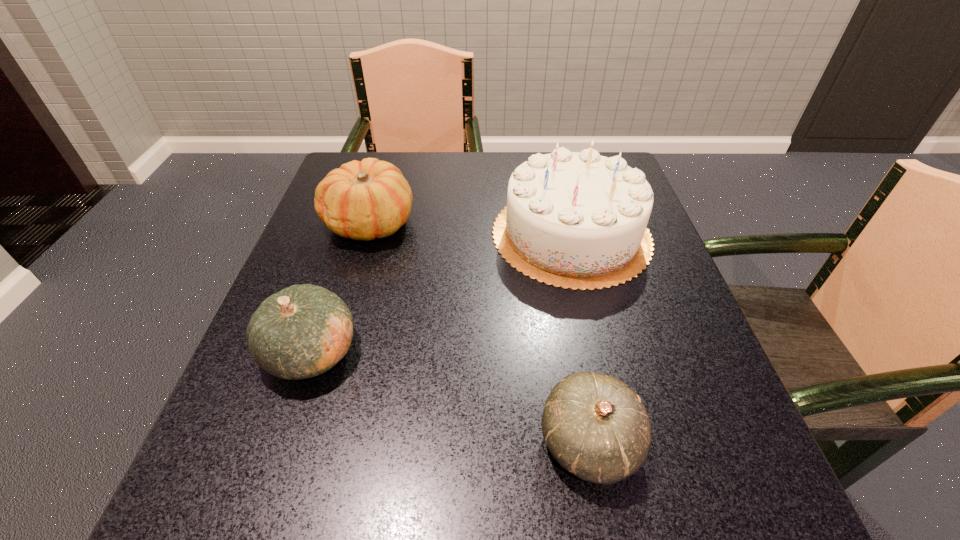
Find the location of a particular element. gourd at the far edge is located at coordinates (370, 199).

Identify the location of object that is at the near edge. (597, 428).

The width and height of the screenshot is (960, 540). What are the coordinates of `birthday cake that is at the right edge` in the screenshot? It's located at (577, 220).

Where is `gourd positioned at the right edge`? gourd positioned at the right edge is located at coordinates (597, 428).

At what (x,y) coordinates should I click in order to perform the action: click on object positioned at the far left corner. Please return your answer as a coordinate pair (x, y). This screenshot has height=540, width=960. Looking at the image, I should click on (370, 199).

Locate an element on the screen. object located at the far right corner is located at coordinates 577,220.

In order to click on object that is at the near right corner in this screenshot , I will do [597, 428].

At what (x,y) coordinates should I click in order to perform the action: click on free location at the far edge of the desktop. Please return your answer as a coordinate pair (x, y). The width and height of the screenshot is (960, 540). Looking at the image, I should click on (472, 164).

This screenshot has height=540, width=960. I want to click on vacant space at the left edge, so click(x=274, y=416).

The image size is (960, 540). Find the location of `free space at the right edge of the desktop`. free space at the right edge of the desktop is located at coordinates (676, 413).